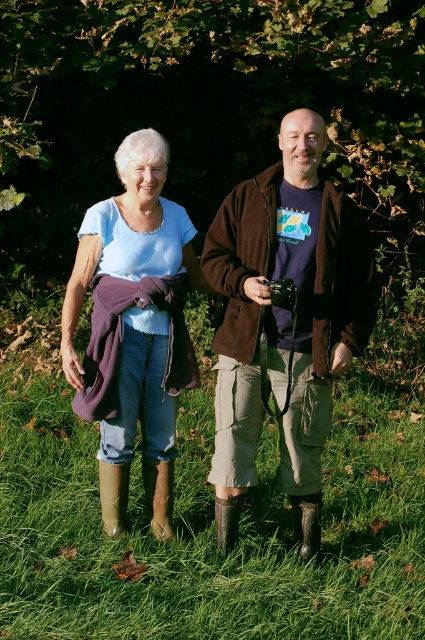
Question: Which object appears farthest from the camera in this image?

Choices:
 (A) brown suede jacket at center
 (B) matte purple scarf at left

Answer: (B)

Question: Where is brown suede jacket at center located in relation to matte purple scarf at left in the image?

Choices:
 (A) right
 (B) left

Answer: (A)

Question: Is brown suede jacket at center smaller than matte purple scarf at left?

Choices:
 (A) no
 (B) yes

Answer: (A)

Question: Which of the following is the farthest from the observer?

Choices:
 (A) matte purple scarf at left
 (B) brown suede jacket at center

Answer: (A)

Question: Can you confirm if brown suede jacket at center is bigger than matte purple scarf at left?

Choices:
 (A) yes
 (B) no

Answer: (A)